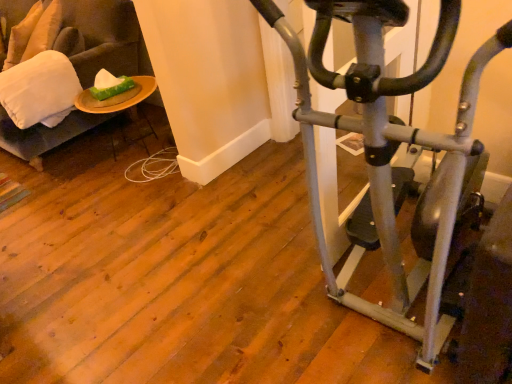
Question: Considering the relative sizes of wooden plate at left and white soft pillow at left, positioned as the first pillow in bottom-to-top order, in the image provided, is wooden plate at left wider than white soft pillow at left, positioned as the first pillow in bottom-to-top order,?

Choices:
 (A) yes
 (B) no

Answer: (B)

Question: Is wooden plate at left bigger than white soft pillow at left, positioned as the first pillow in bottom-to-top order?

Choices:
 (A) yes
 (B) no

Answer: (B)

Question: From the image's perspective, is wooden plate at left below white soft pillow at left, which is counted as the first pillow, starting from the right?

Choices:
 (A) no
 (B) yes

Answer: (B)

Question: Considering the relative sizes of wooden plate at left and white soft pillow at left, arranged as the first pillow when viewed from the front, in the image provided, is wooden plate at left shorter than white soft pillow at left, arranged as the first pillow when viewed from the front,?

Choices:
 (A) no
 (B) yes

Answer: (A)

Question: Is wooden plate at left far from white soft pillow at left, the second pillow viewed from the back?

Choices:
 (A) yes
 (B) no

Answer: (B)

Question: Can you confirm if wooden plate at left is taller than white soft pillow at left, positioned as the first pillow in bottom-to-top order?

Choices:
 (A) no
 (B) yes

Answer: (B)

Question: Considering the relative sizes of velvet beige swivel chair at left and soft beige pillow at upper left, positioned as the 1th pillow in top-to-bottom order, in the image provided, is velvet beige swivel chair at left wider than soft beige pillow at upper left, positioned as the 1th pillow in top-to-bottom order,?

Choices:
 (A) no
 (B) yes

Answer: (B)

Question: Is velvet beige swivel chair at left with soft beige pillow at upper left, positioned as the first pillow in back-to-front order?

Choices:
 (A) yes
 (B) no

Answer: (B)

Question: From the image's perspective, would you say velvet beige swivel chair at left is shown under soft beige pillow at upper left, acting as the second pillow starting from the bottom?

Choices:
 (A) no
 (B) yes

Answer: (B)

Question: Is velvet beige swivel chair at left completely or partially outside of soft beige pillow at upper left, acting as the second pillow starting from the front?

Choices:
 (A) yes
 (B) no

Answer: (A)

Question: Can you confirm if velvet beige swivel chair at left is thinner than soft beige pillow at upper left, acting as the second pillow starting from the bottom?

Choices:
 (A) yes
 (B) no

Answer: (B)

Question: Is the position of velvet beige swivel chair at left more distant than that of soft beige pillow at upper left, positioned as the 1th pillow in top-to-bottom order?

Choices:
 (A) yes
 (B) no

Answer: (B)

Question: Does wooden plate at left have a smaller size compared to soft beige pillow at upper left, acting as the second pillow starting from the bottom?

Choices:
 (A) yes
 (B) no

Answer: (B)